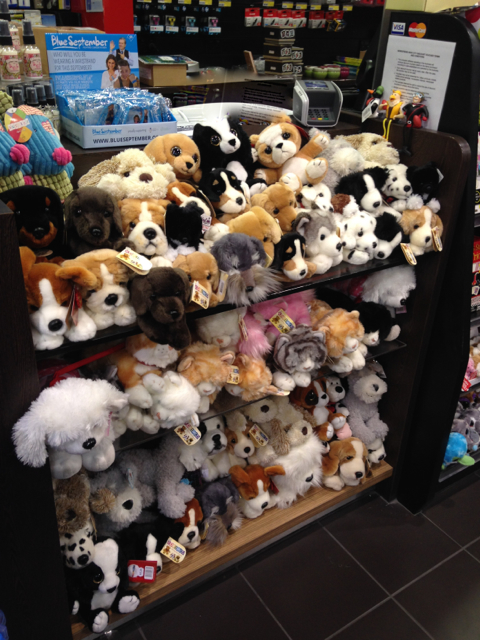
Image resolution: width=480 pixels, height=640 pixels. I want to click on toy, so click(369, 105), click(393, 111), click(412, 109).